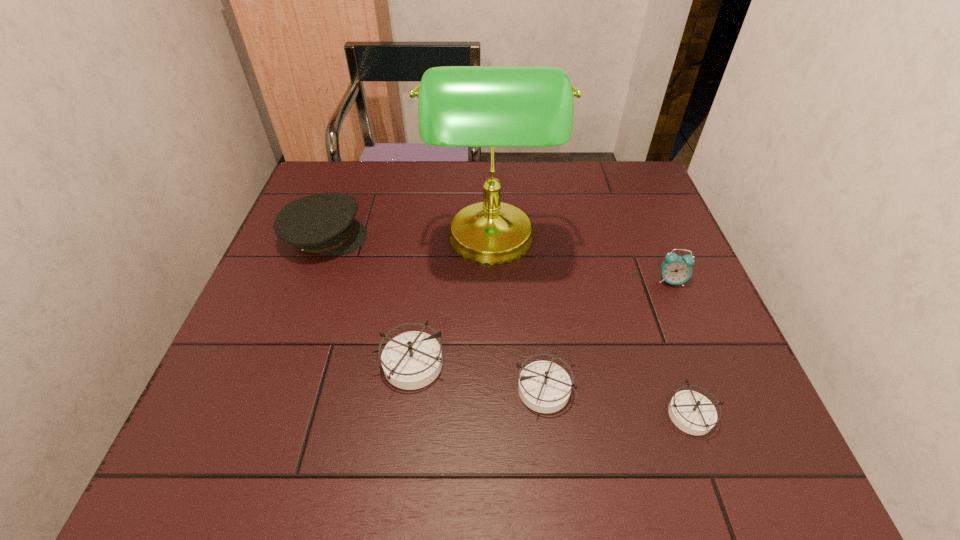
Where is `empty space that is in between the rightmost compass and the beret`? empty space that is in between the rightmost compass and the beret is located at coordinates (508, 325).

In order to click on free space between the lamp and the beret in this screenshot , I will do `click(408, 240)`.

The height and width of the screenshot is (540, 960). In order to click on free point between the lamp and the second compass from left to right in this screenshot , I will do `click(518, 315)`.

Find the location of a particular element. The width and height of the screenshot is (960, 540). vacant space that is in between the leftmost object and the tallest object is located at coordinates (408, 240).

Find the location of a particular element. The image size is (960, 540). free area in between the lamp and the beret is located at coordinates (408, 240).

Locate an element on the screen. free space that is in between the second shortest object and the leftmost object is located at coordinates (435, 313).

The width and height of the screenshot is (960, 540). In order to click on the fifth closest object relative to the tallest compass in this screenshot , I will do `click(675, 269)`.

Locate an element on the screen. the fourth closest object to the leftmost compass is located at coordinates click(693, 413).

Select which compass is the second closest to the shortest object. Please provide its 2D coordinates. Your answer should be formatted as a tuple, i.e. [(x, y)], where the tuple contains the x and y coordinates of a point satisfying the conditions above.

[(411, 360)]

The height and width of the screenshot is (540, 960). Find the location of `compass object that ranks as the second closest to the second tallest compass`. compass object that ranks as the second closest to the second tallest compass is located at coordinates (693, 413).